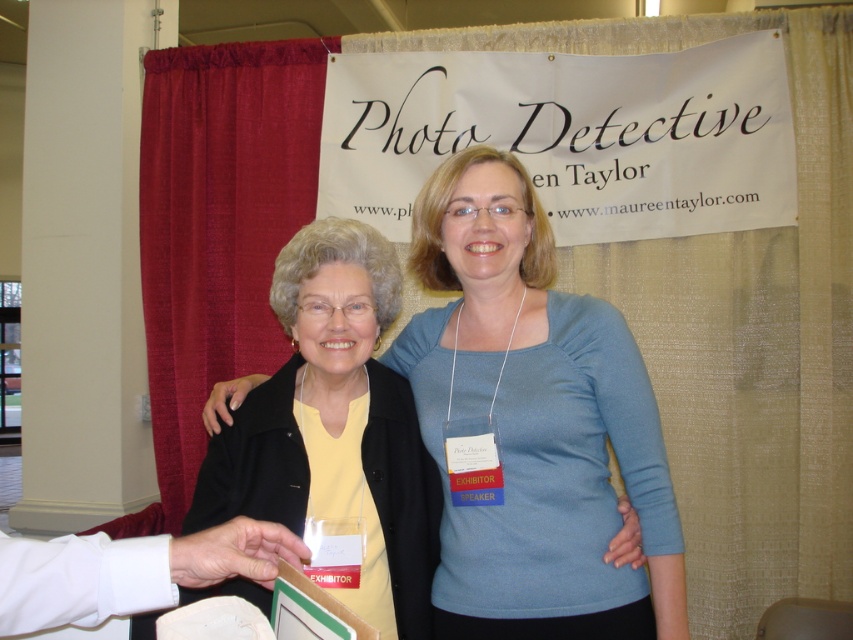
You are a photographer at the event and need to capture a photo of the two people. The camera you are using has a minimum focus distance of 20 inches. Can you focus on both the matte yellow shirt at center and the smooth white skin at lower left without moving the camera?

The matte yellow shirt at center is 22.90 inches from smooth white skin at lower left. Since the distance between them is greater than the camera minimum focus distance of 20 inches, the camera can focus on both the matte yellow shirt at center and the smooth white skin at lower left without moving.

You are at a conference and need to find the person wearing the matte yellow shirt at center. Where should you look relative to the smooth white skin at lower left?

The matte yellow shirt at center is located above the smooth white skin at lower left, so you should look upward from the smooth white skin at lower left to find the matte yellow shirt at center.

You are a photographer at the event and want to capture a group photo. The matte yellow shirt at center and the smooth white skin at lower left are in your frame. Which object should you focus on to ensure both are in focus if your camera has a depth of field limited to 1 meter?

The matte yellow shirt at center and smooth white skin at lower left are within 1 meter of each other, so focusing on the matte yellow shirt at center would keep both in focus.